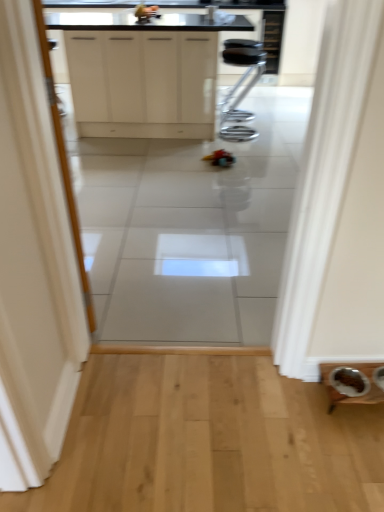
Locate an element on the screen. The height and width of the screenshot is (512, 384). white matte cabinet at upper center is located at coordinates (143, 75).

What do you see at coordinates (143, 75) in the screenshot? I see `white matte cabinet at upper center` at bounding box center [143, 75].

The image size is (384, 512). Identify the location of black metal stool at center. (243, 89).

Looking at this image, what is the approximate width of black metal stool at center?

The width of black metal stool at center is 15.79 inches.

Describe the element at coordinates (243, 89) in the screenshot. I see `black metal stool at center` at that location.

You are a GUI agent. You are given a task and a screenshot of the screen. Output one action in this format:
    pyautogui.click(x=<x>, y=<y>)
    Task: Click on the white matte cabinet at upper center
    
    Given the screenshot: What is the action you would take?
    pyautogui.click(x=143, y=75)

Based on the photo, between white matte cabinet at upper center and black metal stool at center, which one appears on the right side from the viewer's perspective?

black metal stool at center.

Looking at this image, considering their positions, is white matte cabinet at upper center located in front of or behind black metal stool at center?

Clearly, white matte cabinet at upper center is in front of black metal stool at center.

Which is nearer, (199, 63) or (246, 120)?

Point (199, 63) is closer to the camera than point (246, 120).

From the image's perspective, would you say white matte cabinet at upper center is positioned over black metal stool at center?

Yes.

From a real-world perspective, is white matte cabinet at upper center physically located above or below black metal stool at center?

In terms of real-world spatial position, white matte cabinet at upper center is above black metal stool at center.

Based on the photo, considering the sizes of objects white matte cabinet at upper center and black metal stool at center in the image provided, who is thinner, white matte cabinet at upper center or black metal stool at center?

black metal stool at center.

Considering the relative sizes of white matte cabinet at upper center and black metal stool at center in the image provided, is white matte cabinet at upper center taller than black metal stool at center?

Correct, white matte cabinet at upper center is much taller as black metal stool at center.

Looking at the image, does white matte cabinet at upper center seem bigger or smaller compared to black metal stool at center?

In the image, white matte cabinet at upper center appears to be larger than black metal stool at center.

Is white matte cabinet at upper center positioned beyond the bounds of black metal stool at center?

Yes, white matte cabinet at upper center is located beyond the bounds of black metal stool at center.

Is white matte cabinet at upper center beside black metal stool at center?

white matte cabinet at upper center is not next to black metal stool at center, and they're not touching.

Is white matte cabinet at upper center turned away from black metal stool at center?

Yes, white matte cabinet at upper center's orientation is away from black metal stool at center.

Can you tell me how much white matte cabinet at upper center and black metal stool at center differ in facing direction?

0.438 degrees.

Measure the distance between white matte cabinet at upper center and black metal stool at center.

33.42 inches.

In the image, there is a white matte cabinet at upper center. At what (x,y) coordinates should I click in order to perform the action: click on furniture below it (from the image's perspective). Please return your answer as a coordinate pair (x, y). This screenshot has height=512, width=384. Looking at the image, I should click on (243, 89).

In the image, is black metal stool at center on the left side or the right side of white matte cabinet at upper center?

Clearly, black metal stool at center is on the right of white matte cabinet at upper center in the image.

Is black metal stool at center in front of white matte cabinet at upper center?

No.

Which is more distant, (251, 45) or (144, 30)?

The point (251, 45) is more distant.

From the image's perspective, would you say black metal stool at center is shown under white matte cabinet at upper center?

Yes, from the image's perspective, black metal stool at center is below white matte cabinet at upper center.

From a real-world perspective, between black metal stool at center and white matte cabinet at upper center, who is vertically lower?

black metal stool at center.

Looking at their sizes, would you say black metal stool at center is wider or thinner than white matte cabinet at upper center?

black metal stool at center is thinner than white matte cabinet at upper center.

Which of these two, black metal stool at center or white matte cabinet at upper center, stands taller?

With more height is white matte cabinet at upper center.

Based on their sizes in the image, would you say black metal stool at center is bigger or smaller than white matte cabinet at upper center?

Clearly, black metal stool at center is smaller in size than white matte cabinet at upper center.

Is black metal stool at center positioned beyond the bounds of white matte cabinet at upper center?

No, black metal stool at center is not entirely external to white matte cabinet at upper center.

Is there a large distance between black metal stool at center and white matte cabinet at upper center?

black metal stool at center is actually quite close to white matte cabinet at upper center.

Based on the photo, is black metal stool at center oriented towards white matte cabinet at upper center?

Yes, black metal stool at center is aimed at white matte cabinet at upper center.

How different are the orientations of black metal stool at center and white matte cabinet at upper center in degrees?

The angular difference between black metal stool at center and white matte cabinet at upper center is 0.438 degrees.

How far apart are black metal stool at center and white matte cabinet at upper center?

black metal stool at center is 33.42 inches away from white matte cabinet at upper center.

The width and height of the screenshot is (384, 512). I want to click on cabinetry located above the black metal stool at center (from the image's perspective), so click(x=143, y=75).

Locate an element on the screen. This screenshot has width=384, height=512. cabinetry that appears above the black metal stool at center (from a real-world perspective) is located at coordinates (143, 75).

Find the location of a particular element. cabinetry that appears above the black metal stool at center (from the image's perspective) is located at coordinates (143, 75).